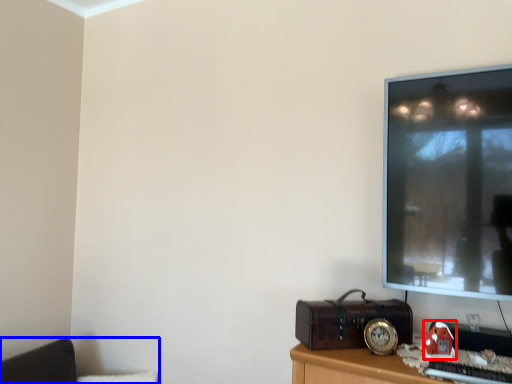
Question: Which object appears farthest to the camera in this image, toy (highlighted by a red box) or furniture (highlighted by a blue box)?

Choices:
 (A) toy
 (B) furniture

Answer: (B)